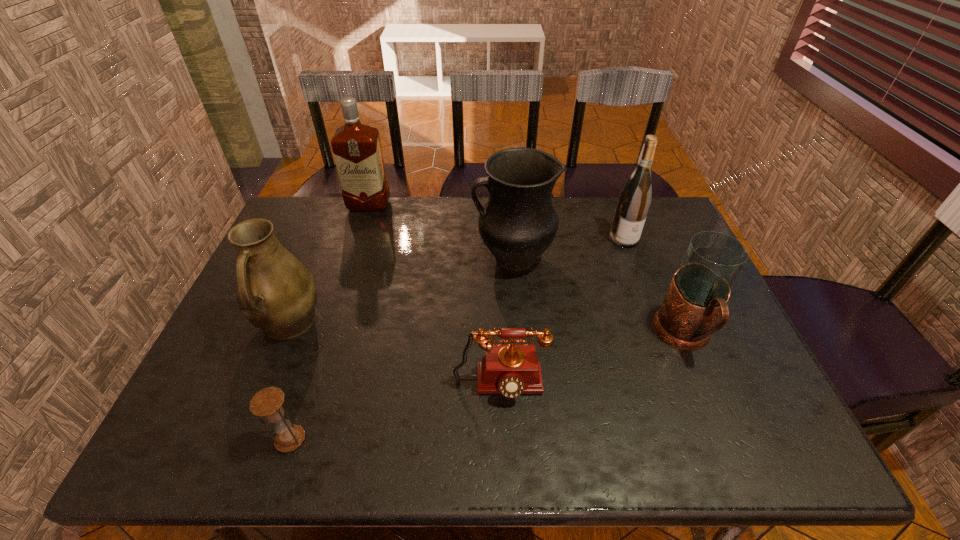
At what (x,y) coordinates should I click in order to perform the action: click on vacant region located on the handle side of the farthest pitcher. Please return your answer as a coordinate pair (x, y). The width and height of the screenshot is (960, 540). Looking at the image, I should click on (420, 258).

Locate an element on the screen. Image resolution: width=960 pixels, height=540 pixels. vacant space located 0.230m on the handle side of the farthest pitcher is located at coordinates (397, 258).

Locate an element on the screen. This screenshot has width=960, height=540. vacant space located 0.160m on the handle side of the farthest pitcher is located at coordinates (420, 258).

You are a GUI agent. You are given a task and a screenshot of the screen. Output one action in this format:
    pyautogui.click(x=<x>, y=<y>)
    Task: Click on the free spot located on the handle side of the leftmost pitcher
    Image resolution: width=960 pixels, height=540 pixels.
    Given the screenshot: What is the action you would take?
    click(255, 404)

Locate an element on the screen. vacant space situated 0.180m with the handle on the side of the rightmost pitcher is located at coordinates (728, 439).

Where is `vacant region located on the left of the nearest object`? The image size is (960, 540). vacant region located on the left of the nearest object is located at coordinates (242, 440).

At what (x,y) coordinates should I click in order to perform the action: click on liquor located in the far edge section of the desktop. Please return your answer as a coordinate pair (x, y). Looking at the image, I should click on (356, 147).

This screenshot has width=960, height=540. What are the coordinates of `wine bottle that is positioned at the far edge` in the screenshot? It's located at (634, 200).

Where is `pitcher that is at the far edge`? This screenshot has height=540, width=960. pitcher that is at the far edge is located at coordinates (518, 223).

Where is `object located at the near edge`? Image resolution: width=960 pixels, height=540 pixels. object located at the near edge is located at coordinates (268, 402).